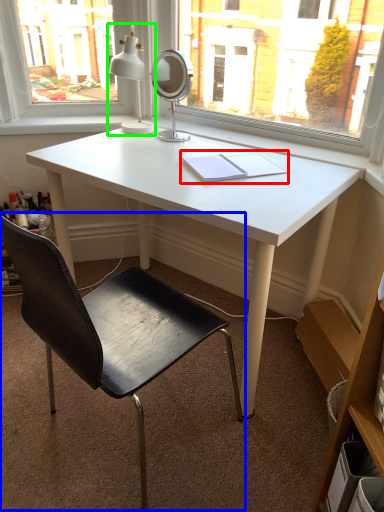
Question: Considering the real-world distances, which object is closest to notebook (highlighted by a red box)? chair (highlighted by a blue box) or table lamp (highlighted by a green box).

Choices:
 (A) chair
 (B) table lamp

Answer: (B)